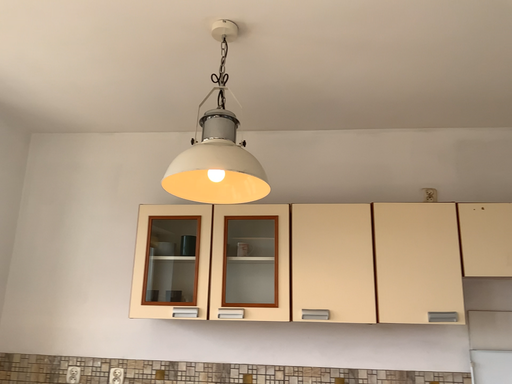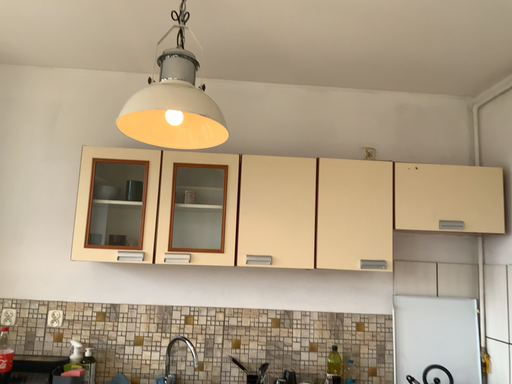
Question: Which way did the camera rotate in the video?

Choices:
 (A) rotated right
 (B) rotated left

Answer: (A)